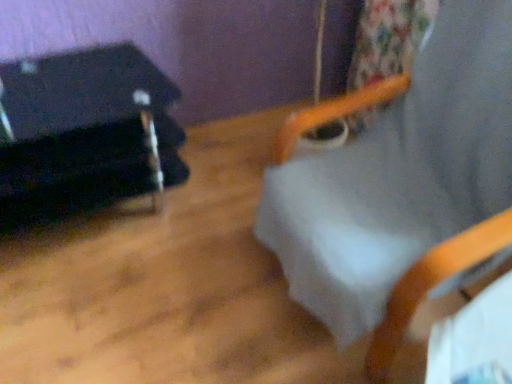
This screenshot has width=512, height=384. In order to click on vacant location below black fabric at left (from a real-world perspective) in this screenshot , I will do `click(98, 221)`.